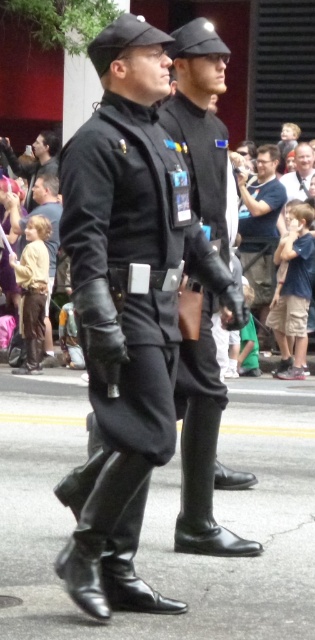
You are standing at the front of the scene and want to see the matte black jacket at upper left. Is the brown leather pants at lower left blocking your view of it?

The brown leather pants at lower left is in front of matte black jacket at upper left, so yes, the brown leather pants at lower left is blocking your view of the matte black jacket at upper left.

You are a photographer at the event and need to capture both the matte black uniform at center and the black leather boot at lower left in the same frame. Based on their positions, which object should you adjust your camera angle to focus on first to ensure both are in the shot?

The matte black uniform at center is to the right of the black leather boot at lower left, so you should focus on the black leather boot at lower left first to ensure both are in the frame.